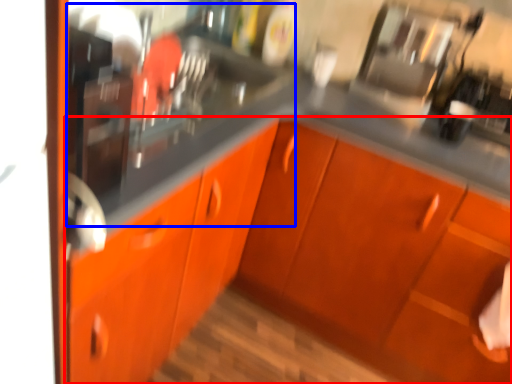
Question: Which point is closer to the camera, cabinetry (highlighted by a red box) or sink (highlighted by a blue box)?

Choices:
 (A) cabinetry
 (B) sink

Answer: (A)